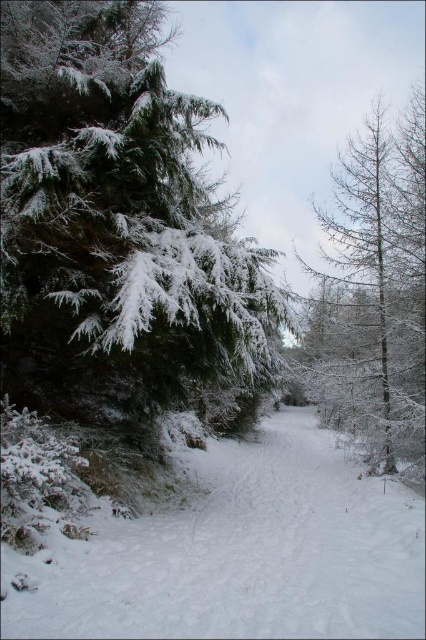
Can you confirm if snow-covered evergreen at left is positioned below white fluffy snow at center?

No, snow-covered evergreen at left is not below white fluffy snow at center.

Is snow-covered evergreen at left wider than white fluffy snow at center?

No, snow-covered evergreen at left is not wider than white fluffy snow at center.

Image resolution: width=426 pixels, height=640 pixels. What do you see at coordinates (115, 221) in the screenshot?
I see `snow-covered evergreen at left` at bounding box center [115, 221].

You are a GUI agent. You are given a task and a screenshot of the screen. Output one action in this format:
    pyautogui.click(x=<x>, y=<y>)
    Task: Click on the snow-covered evergreen at left
    The height and width of the screenshot is (640, 426).
    Given the screenshot: What is the action you would take?
    pyautogui.click(x=115, y=221)

Can you confirm if white fluffy snow at center is positioned below snow-covered larch at right?

Yes.

Between point (98, 600) and point (367, 275), which one is positioned in front?

Point (98, 600) is in front.

Based on the photo, measure the distance between point (307,608) and camera.

4.79 meters

The height and width of the screenshot is (640, 426). Identify the location of white fluffy snow at center. (244, 554).

Does snow-covered evergreen at left have a greater height compared to snow-covered larch at right?

In fact, snow-covered evergreen at left may be shorter than snow-covered larch at right.

Between snow-covered evergreen at left and snow-covered larch at right, which one has more height?

snow-covered larch at right

Is point (89, 362) positioned before point (322, 394)?

Yes, point (89, 362) is closer to viewer.

Find the location of a particular element. This screenshot has height=640, width=426. snow-covered evergreen at left is located at coordinates (115, 221).